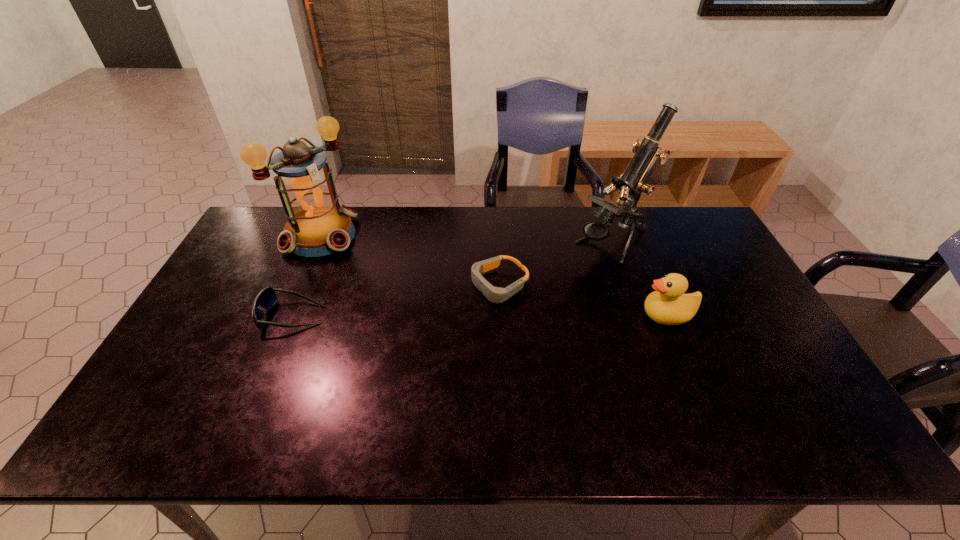
Find the location of a particular element. vacant area situated 0.230m on the front and back of the shortest object is located at coordinates (406, 329).

Image resolution: width=960 pixels, height=540 pixels. I want to click on microscope present at the far edge, so click(631, 183).

You are a GUI agent. You are given a task and a screenshot of the screen. Output one action in this format:
    pyautogui.click(x=<x>, y=<y>)
    Task: Click on the lantern positioned at the far edge
    This screenshot has width=960, height=540.
    Given the screenshot: What is the action you would take?
    pyautogui.click(x=318, y=225)

Find the location of a particular element. The image size is (960, 540). object that is positioned at the left edge is located at coordinates (318, 225).

Where is `object located in the far left corner section of the desktop`? Image resolution: width=960 pixels, height=540 pixels. object located in the far left corner section of the desktop is located at coordinates (318, 225).

Locate an element on the screen. This screenshot has height=540, width=960. free location at the far edge of the desktop is located at coordinates (640, 238).

In the image, there is a desktop. Identify the location of vacant space at the near edge. (384, 404).

Locate an element on the screen. The width and height of the screenshot is (960, 540). vacant space at the left edge of the desktop is located at coordinates (209, 310).

Locate an element on the screen. The width and height of the screenshot is (960, 540). free space at the right edge of the desktop is located at coordinates (701, 255).

At what (x,y) coordinates should I click in order to perform the action: click on free space at the far left corner of the desktop. Please return your answer as a coordinate pair (x, y). The height and width of the screenshot is (540, 960). Looking at the image, I should click on (273, 224).